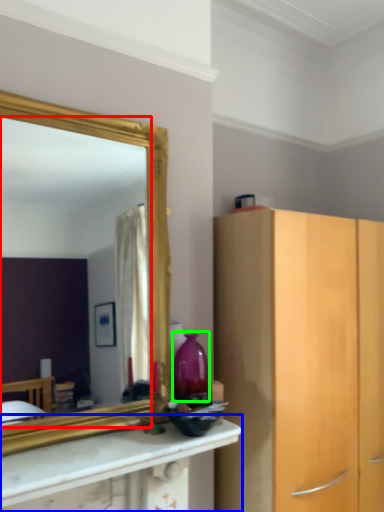
Question: Which is farther away from mirror (highlighted by a red box)? countertop (highlighted by a blue box) or vase (highlighted by a green box)?

Choices:
 (A) countertop
 (B) vase

Answer: (B)